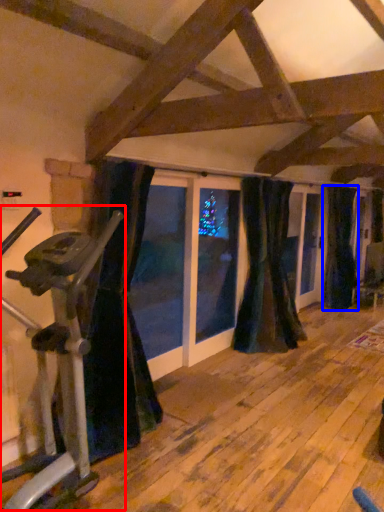
Question: Which point is closer to the camera, stationary bicycle (highlighted by a red box) or curtain (highlighted by a blue box)?

Choices:
 (A) stationary bicycle
 (B) curtain

Answer: (A)